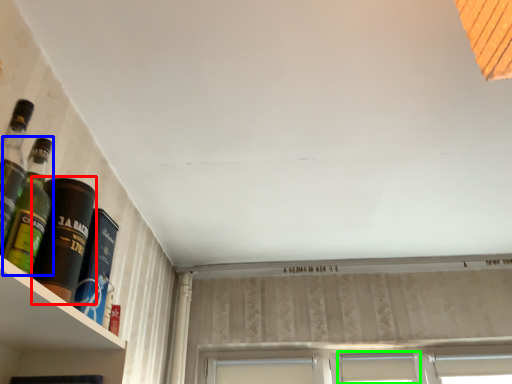
Question: Which object is the closest to the bottle (highlighted by a red box)? Choose among these: bottle (highlighted by a blue box) or window (highlighted by a green box).

Choices:
 (A) bottle
 (B) window

Answer: (A)